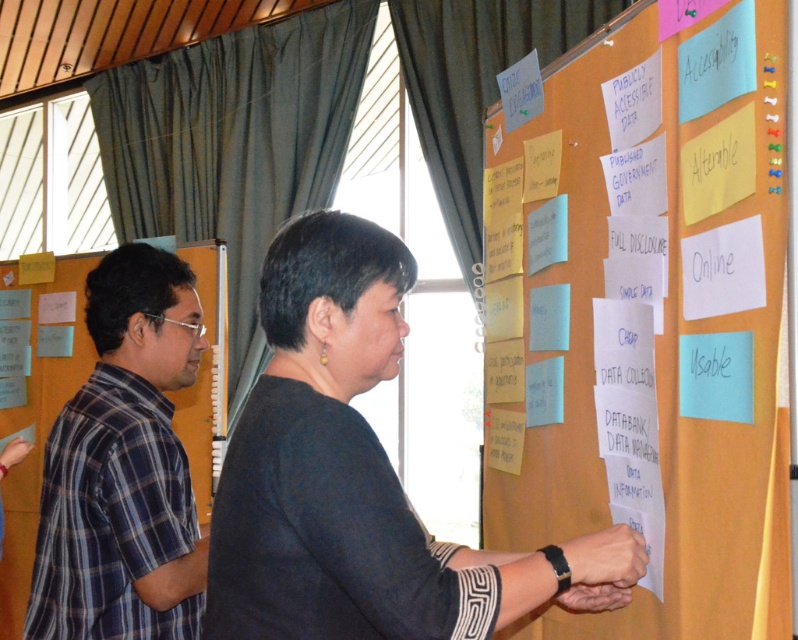
Question: Based on their relative distances, which object is nearer to the dark gray sweater at center?

Choices:
 (A) light brown corkboard at upper right
 (B) plaid shirt at left

Answer: (A)

Question: Is light brown corkboard at upper right wider than black leather watch at center?

Choices:
 (A) yes
 (B) no

Answer: (A)

Question: Is light brown corkboard at upper right above black leather watch at center?

Choices:
 (A) no
 (B) yes

Answer: (B)

Question: Observing the image, what is the correct spatial positioning of light brown corkboard at upper right in reference to plaid shirt at left?

Choices:
 (A) above
 (B) below

Answer: (A)

Question: Which is farther from the light brown corkboard at upper right?

Choices:
 (A) plaid shirt at left
 (B) dark gray sweater at center
 (C) black leather watch at center

Answer: (A)

Question: Which of the following is the farthest from the observer?

Choices:
 (A) (658, 426)
 (B) (575, 576)

Answer: (A)